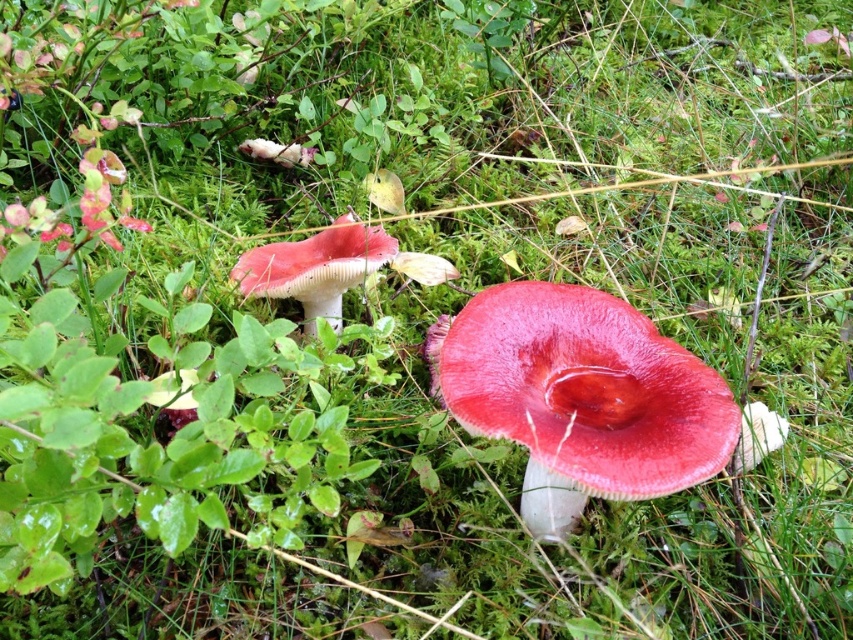
You are a forager in the forest and see two mushrooms, the shiny red mushroom at center and the glossy red mushroom at center. Which one is more to the right?

The shiny red mushroom at center is positioned on the right side of the glossy red mushroom at center, so it is more to the right.

You are a mycologist examining two mushrooms in a forest. You notice the shiny red mushroom at center and the glossy red mushroom at center. Which one is closer to you?

The shiny red mushroom at center is closer to you because it is in front of the glossy red mushroom at center.

You are a botanist studying the spatial distribution of mushrooms in a forest. You have a map with coordinates where the forest floor is represented as a grid. According to the image, where is the shiny red mushroom at center located on the grid?

The shiny red mushroom at center is located at coordinates point [579,396].